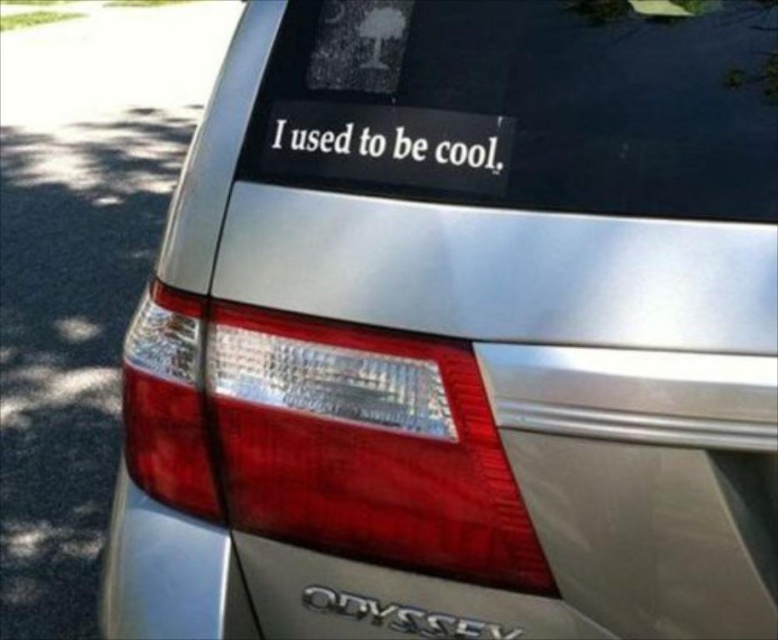
You are a delivery person trying to read the text on the white matte sticker at center and the black metallic odyssey at lower center. Which one is larger in size?

The white matte sticker at center is bigger than the black metallic odyssey at lower center, so the white matte sticker at center is larger in size.

You are standing in front of a silver Honda Odyssey minivan parked in a parking lot. You notice a point at coordinates point (389, 144). What object is this point located on?

The point (389, 144) is located on the white matte sticker at center.

You are a delivery person trying to read the message on the white matte sticker at center and the black metallic odyssey at lower center from the sidewalk. Which sticker is easier to read from a distance?

The white matte sticker at center is positioned on the left side of black metallic odyssey at lower center, so it is more visible from the sidewalk and easier to read.